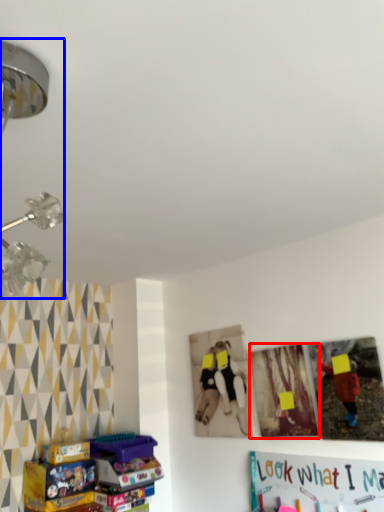
Question: Which of the following is the farthest to the observer, picture frame (highlighted by a red box) or lamp (highlighted by a blue box)?

Choices:
 (A) picture frame
 (B) lamp

Answer: (A)